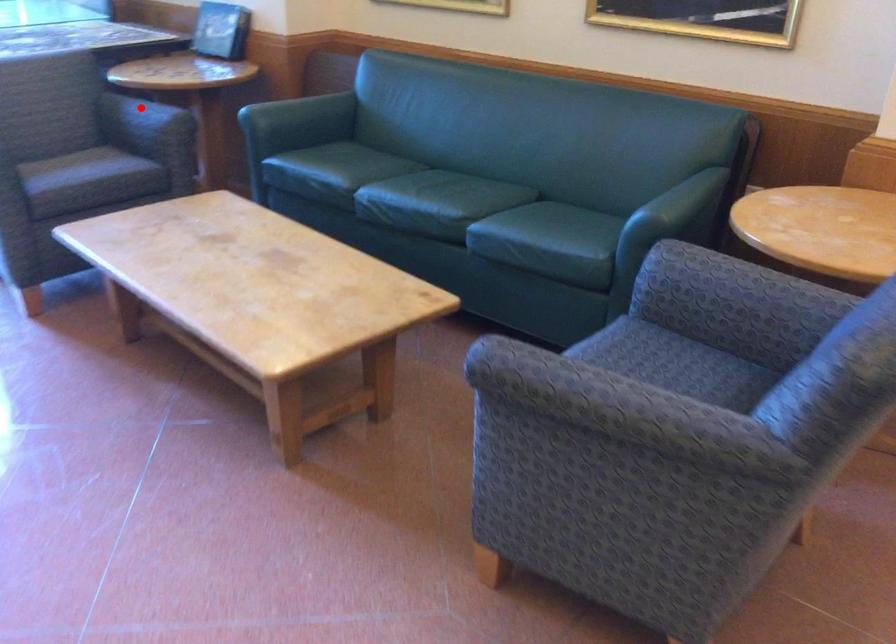
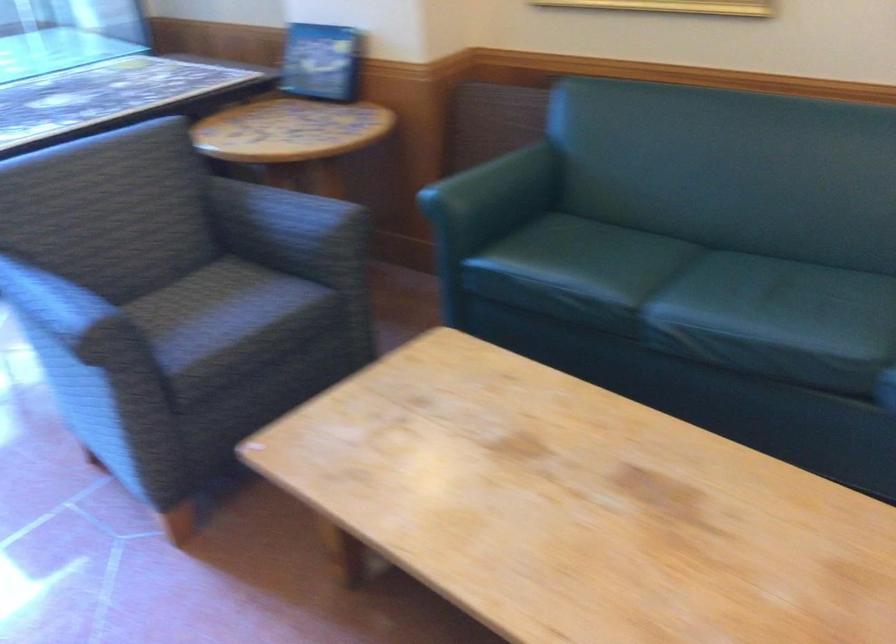
Where in the second image is the point corresponding to the highlighted location from the first image?

(287, 211)